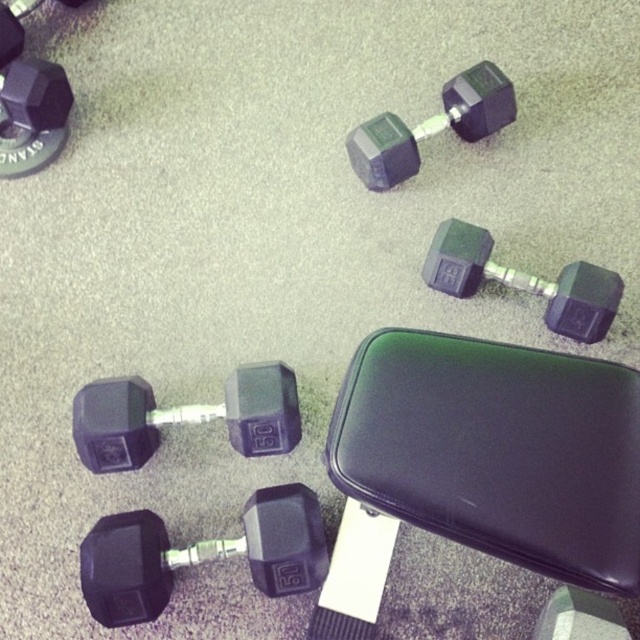
You are a gym trainer looking to organize equipment. You see the rubberized black dumbbell at lower center and the point at (184, 417). Is the dumbbell located exactly at that point?

Yes, the rubberized black dumbbell at lower center is located exactly at point (184, 417).

You are a gym trainer who needs to move the rubberized black dumbbell at upper center to a storage rack behind the matte black dumbbell at center right. Can you access it without moving the matte black dumbbell first?

The matte black dumbbell at center right is in front of the rubberized black dumbbell at upper center, so you cannot access the rubberized black dumbbell at upper center without moving the matte black dumbbell at center right first.